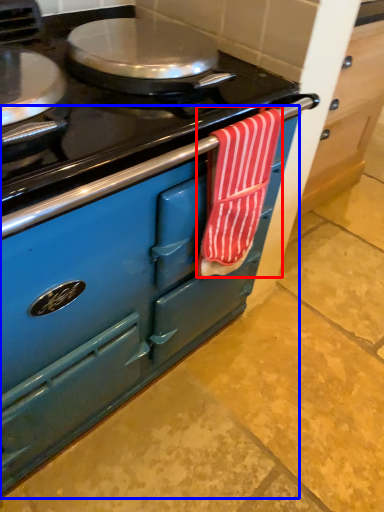
Question: Which point is further to the camera, beach towel (highlighted by a red box) or cabinetry (highlighted by a blue box)?

Choices:
 (A) beach towel
 (B) cabinetry

Answer: (A)